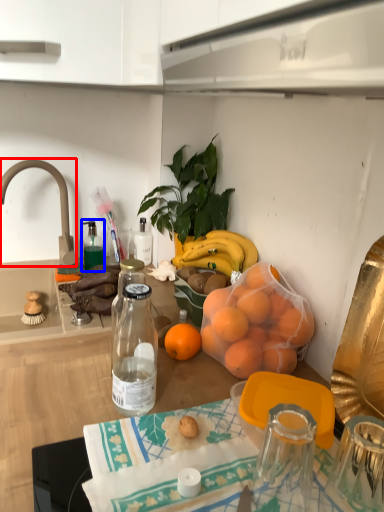
Question: Which of the following is the closest to the observer, faucet (highlighted by a red box) or bottle (highlighted by a blue box)?

Choices:
 (A) faucet
 (B) bottle

Answer: (A)